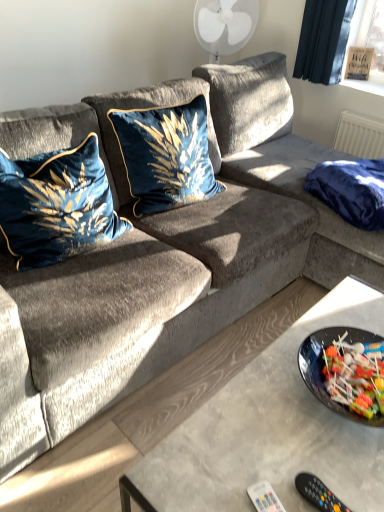
Question: Is white plastic remote at lower center in contact with velvet blue pillow at center, the second pillow positioned from the left?

Choices:
 (A) no
 (B) yes

Answer: (A)

Question: Is the depth of white plastic remote at lower center less than that of velvet blue pillow at center, the second pillow positioned from the left?

Choices:
 (A) no
 (B) yes

Answer: (B)

Question: Can you confirm if white plastic remote at lower center is positioned to the left of velvet blue pillow at center, which ranks as the 1th pillow in right-to-left order?

Choices:
 (A) yes
 (B) no

Answer: (B)

Question: Does white plastic remote at lower center lie behind velvet blue pillow at center, the second pillow positioned from the left?

Choices:
 (A) yes
 (B) no

Answer: (B)

Question: Can you confirm if white plastic remote at lower center is shorter than velvet blue pillow at center, which ranks as the 1th pillow in right-to-left order?

Choices:
 (A) yes
 (B) no

Answer: (A)

Question: From the image's perspective, is velvet blue pillow at center, which ranks as the 1th pillow in right-to-left order, above or below navy blue fabric at right?

Choices:
 (A) below
 (B) above

Answer: (B)

Question: Looking at the image, does velvet blue pillow at center, which ranks as the 1th pillow in right-to-left order, seem bigger or smaller compared to navy blue fabric at right?

Choices:
 (A) big
 (B) small

Answer: (A)

Question: From a real-world perspective, is velvet blue pillow at center, which ranks as the 1th pillow in right-to-left order, physically located above or below navy blue fabric at right?

Choices:
 (A) above
 (B) below

Answer: (A)

Question: In the image, is velvet blue pillow at center, the second pillow positioned from the left, positioned in front of or behind navy blue fabric at right?

Choices:
 (A) behind
 (B) front

Answer: (B)

Question: From the image's perspective, is black plastic remote control at lower right above or below white plastic remote at lower center?

Choices:
 (A) above
 (B) below

Answer: (A)

Question: Looking at their shapes, would you say black plastic remote control at lower right is wider or thinner than white plastic remote at lower center?

Choices:
 (A) wide
 (B) thin

Answer: (B)

Question: Does point (329, 501) appear closer or farther from the camera than point (271, 489)?

Choices:
 (A) farther
 (B) closer

Answer: (B)

Question: Would you say black plastic remote control at lower right is to the left or to the right of white plastic remote at lower center in the picture?

Choices:
 (A) left
 (B) right

Answer: (B)

Question: Looking at the image, does velvet blue pillow at left, placed as the first pillow when sorted from left to right, seem bigger or smaller compared to navy blue fabric at right?

Choices:
 (A) big
 (B) small

Answer: (A)

Question: Looking at their shapes, would you say velvet blue pillow at left, arranged as the second pillow when viewed from the right, is wider or thinner than navy blue fabric at right?

Choices:
 (A) wide
 (B) thin

Answer: (B)